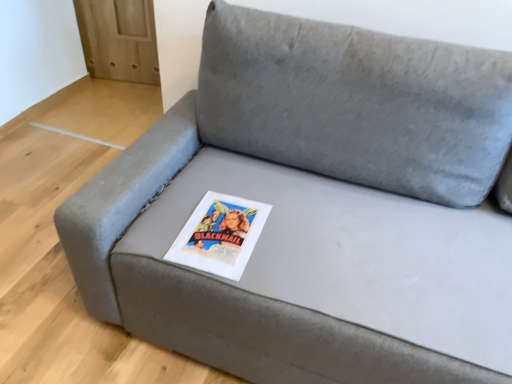
The height and width of the screenshot is (384, 512). What do you see at coordinates (220, 235) in the screenshot? I see `matte paper poster at center` at bounding box center [220, 235].

Where is `matte paper poster at center`? matte paper poster at center is located at coordinates (220, 235).

Identify the location of matte paper poster at center. (220, 235).